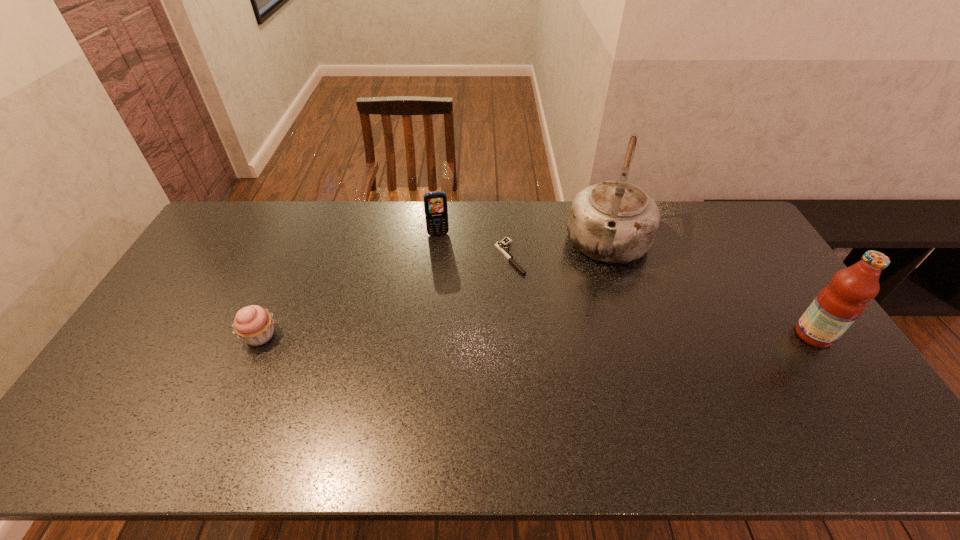
Where is `kettle positioned at the far edge`? kettle positioned at the far edge is located at coordinates (614, 221).

The height and width of the screenshot is (540, 960). I want to click on pistol at the far edge, so click(x=501, y=246).

Where is `cellular telephone situated at the far edge`? The height and width of the screenshot is (540, 960). cellular telephone situated at the far edge is located at coordinates (435, 203).

At what (x,y) coordinates should I click in order to perform the action: click on object located at the right edge. Please return your answer as a coordinate pair (x, y). The height and width of the screenshot is (540, 960). Looking at the image, I should click on (839, 304).

Find the location of `vacant region at the far edge`. vacant region at the far edge is located at coordinates (465, 218).

In the image, there is a desktop. At what (x,y) coordinates should I click in order to perform the action: click on free space at the near edge. Please return your answer as a coordinate pair (x, y). The image size is (960, 540). Looking at the image, I should click on (221, 404).

In the image, there is a desktop. Identify the location of free space at the far left corner. This screenshot has width=960, height=540. (246, 208).

You are a GUI agent. You are given a task and a screenshot of the screen. Output one action in this format:
    pyautogui.click(x=<x>, y=<y>)
    Task: Click on the vacant space at the near right corner of the desktop
    This screenshot has height=540, width=960.
    Given the screenshot: What is the action you would take?
    pyautogui.click(x=861, y=397)

At what (x,y) coordinates should I click in order to perform the action: click on unoccupied position between the cupcake and the rightmost object. Please return your answer as a coordinate pair (x, y). Looking at the image, I should click on (537, 335).

Where is `empty space that is in between the leftmost object and the third shortest object`? This screenshot has width=960, height=540. empty space that is in between the leftmost object and the third shortest object is located at coordinates (349, 285).